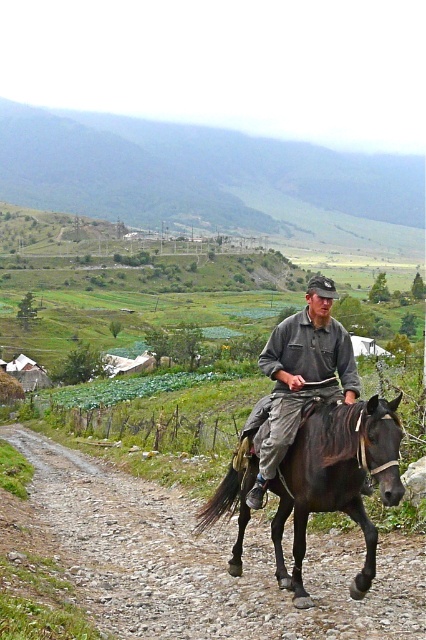
Question: Which of the following is the farthest from the observer?

Choices:
 (A) gray cotton shirt at center
 (B) green grassy hillside at upper center
 (C) gravelly dirt track at center

Answer: (B)

Question: Can you confirm if gravelly dirt track at center is positioned below gray cotton shirt at center?

Choices:
 (A) no
 (B) yes

Answer: (B)

Question: Which object is the closest to the green grassy hillside at upper center?

Choices:
 (A) shiny black horse at center
 (B) gravelly dirt track at center
 (C) gray cotton shirt at center

Answer: (B)

Question: Does gravelly dirt track at center have a greater width compared to shiny black horse at center?

Choices:
 (A) no
 (B) yes

Answer: (B)

Question: Is shiny black horse at center behind gray cotton shirt at center?

Choices:
 (A) yes
 (B) no

Answer: (B)

Question: Which point is closer to the camera?

Choices:
 (A) gray cotton shirt at center
 (B) green grassy hillside at upper center

Answer: (A)